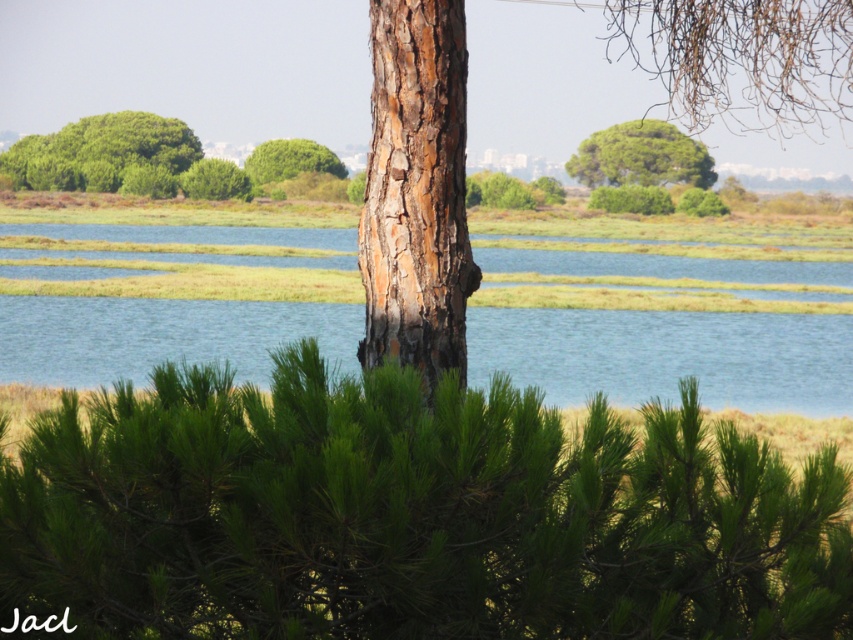
Which is above, green rough bark tree at upper center or green leafy tree at center?

green rough bark tree at upper center is higher up.

Measure the distance between green rough bark tree at upper center and camera.

They are 116.79 meters apart.

Image resolution: width=853 pixels, height=640 pixels. I want to click on green rough bark tree at upper center, so click(x=641, y=156).

Does blue water at center appear under green rough bark tree at upper center?

Yes.

Is blue water at center wider than green rough bark tree at upper center?

Indeed, blue water at center has a greater width compared to green rough bark tree at upper center.

Describe the element at coordinates (668, 355) in the screenshot. I see `blue water at center` at that location.

Identify the location of blue water at center. The image size is (853, 640). (668, 355).

Between point (842, 413) and point (268, 147), which one is positioned in front?

Point (842, 413) is more forward.

Is point (805, 406) farther from viewer compared to point (299, 164)?

No.

At what (x,y) coordinates should I click in order to perform the action: click on blue water at center. Please return your answer as a coordinate pair (x, y). Looking at the image, I should click on (668, 355).